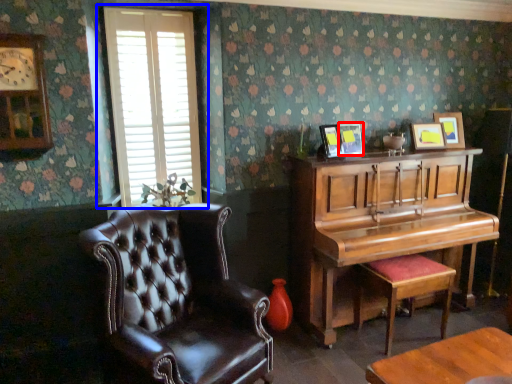
Question: Which object appears farthest to the camera in this image, picture frame (highlighted by a red box) or window (highlighted by a blue box)?

Choices:
 (A) picture frame
 (B) window

Answer: (A)